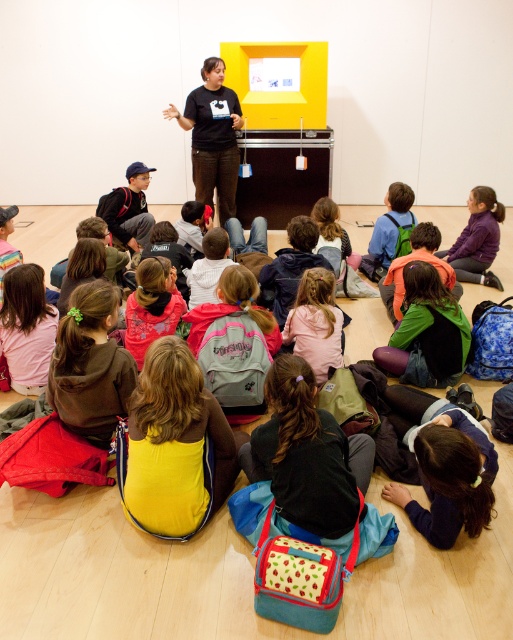
Question: Which point is farther to the camera?

Choices:
 (A) (224, 90)
 (B) (435, 253)

Answer: (A)

Question: Where is pink fabric backpack at center located in relation to purple fleece jacket at lower right in the image?

Choices:
 (A) above
 (B) below

Answer: (B)

Question: Which object is farther from the camera taking this photo?

Choices:
 (A) black matte shirt at center
 (B) pink fabric backpack at center

Answer: (A)

Question: Is black matte shirt at center to the left of pink fabric backpack at center from the viewer's perspective?

Choices:
 (A) no
 (B) yes

Answer: (B)

Question: Which object appears closest to the camera in this image?

Choices:
 (A) pink fabric backpack at center
 (B) black matte shirt at center

Answer: (A)

Question: Does pink fabric backpack at center appear over purple fleece jacket at lower right?

Choices:
 (A) no
 (B) yes

Answer: (A)